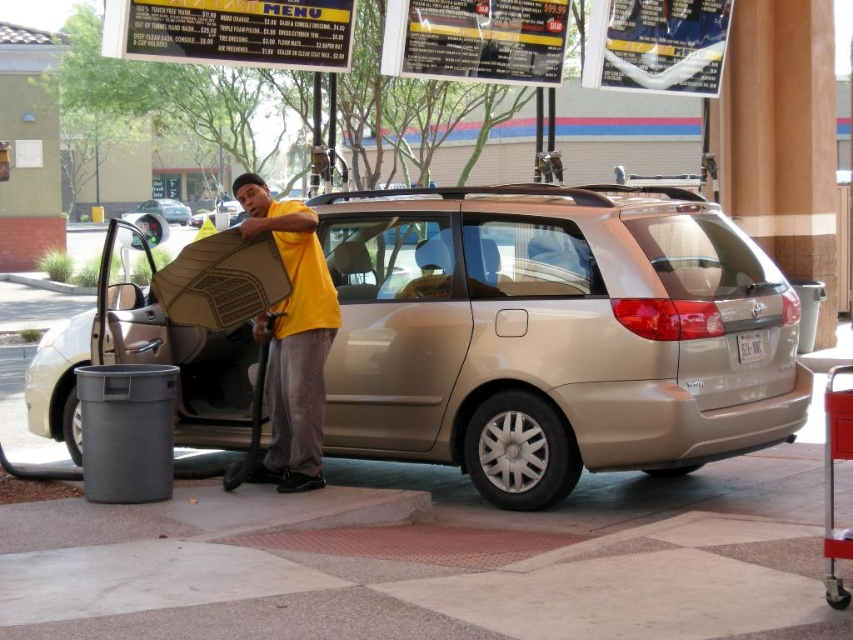
You are a delivery person with a cart that is 2 meters wide. You need to navigate through the car wash area to reach the entrance. Is there enough space between the gold metallic suv at center and the yellow matte shirt at center for your cart to pass through?

The distance between the gold metallic suv at center and the yellow matte shirt at center is 2.56 meters. Since your cart is 2 meters wide, there is sufficient space for the cart to pass through the gap between them.

You are a customer at the car wash facility and want to clean your car. You see the gold metallic suv at center and the yellow matte shirt at center. Which object is bigger in size?

The gold metallic suv at center is larger in size compared to the yellow matte shirt at center.